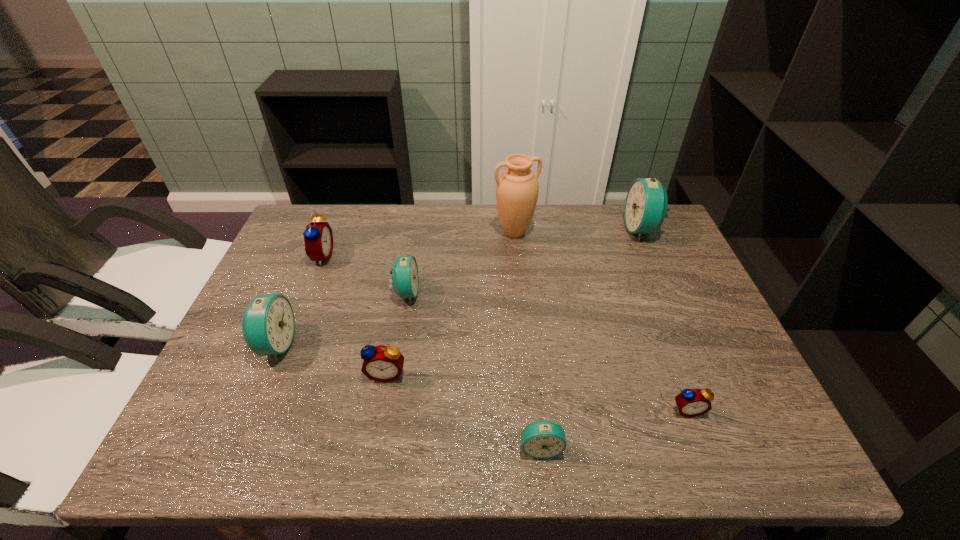
At what (x,y) coordinates should I click in order to perform the action: click on vacant space situated on the front-facing side of the second nearest blue alarm clock. Please return your answer as a coordinate pair (x, y). Looking at the image, I should click on 432,345.

This screenshot has width=960, height=540. I want to click on free location located on the front-facing side of the second farthest blue alarm clock, so click(554, 293).

Identify the location of free location located on the front-facing side of the second red alarm clock from right to left. The height and width of the screenshot is (540, 960). tap(375, 435).

The width and height of the screenshot is (960, 540). I want to click on vacant space located on the front-facing side of the second nearest alarm clock, so click(707, 461).

Identify the location of urn located in the far edge section of the desktop. (517, 188).

At what (x,y) coordinates should I click in order to perform the action: click on object that is positioned at the near edge. Please return your answer as a coordinate pair (x, y). Looking at the image, I should click on (543, 439).

Identify the location of object located in the far left corner section of the desktop. (318, 238).

Image resolution: width=960 pixels, height=540 pixels. Find the location of `object located at the far right corner`. object located at the far right corner is located at coordinates (646, 203).

You are a GUI agent. You are given a task and a screenshot of the screen. Output one action in this format:
    pyautogui.click(x=<x>, y=<y>)
    Task: Click on the free space at the far edge
    The height and width of the screenshot is (540, 960).
    Given the screenshot: What is the action you would take?
    pyautogui.click(x=600, y=228)

Find the location of a particular element. This screenshot has width=960, height=540. free space at the near edge is located at coordinates (301, 425).